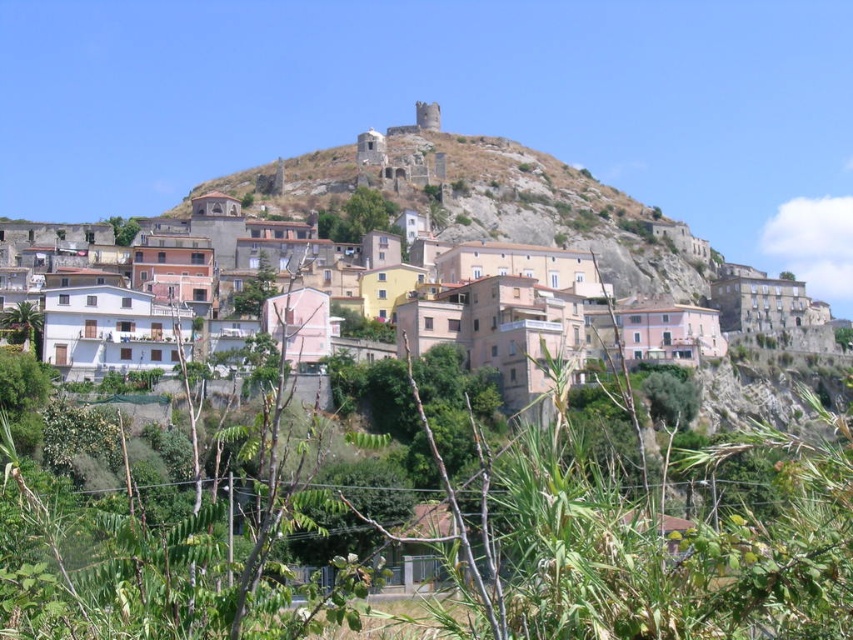
Between green leafy plants at center and pastel painted houses at center, which one is positioned lower?

green leafy plants at center

Which of these two, green leafy plants at center or pastel painted houses at center, stands taller?

pastel painted houses at center is taller.

Between point (602, 531) and point (587, 253), which one is positioned behind?

Positioned behind is point (587, 253).

Identify the location of green leafy plants at center. This screenshot has height=640, width=853. (462, 548).

Who is more forward, (550, 500) or (704, 257)?

Point (550, 500) is in front.

Is point (329, 502) positioned after point (622, 246)?

No, (329, 502) is in front of (622, 246).

Is point (549, 492) in front of point (677, 296)?

Yes, it is in front of point (677, 296).

I want to click on green leafy plants at center, so click(x=462, y=548).

Is the position of pastel painted houses at center more distant than that of rustic stone castle at upper center?

No.

At what (x,y) coordinates should I click in order to perform the action: click on pastel painted houses at center. Please return your answer as a coordinate pair (x, y). Looking at the image, I should click on (567, 308).

What are the coordinates of `pastel painted houses at center` in the screenshot? It's located at (567, 308).